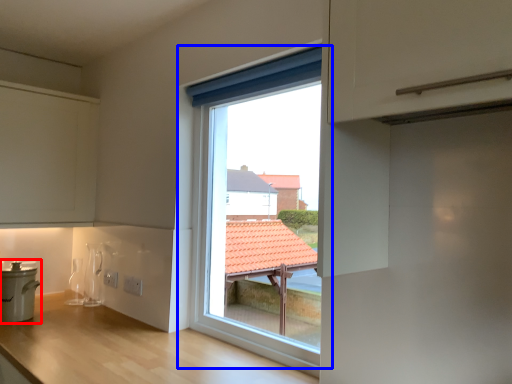
Question: Which point is further to the camera, cooker (highlighted by a red box) or window (highlighted by a blue box)?

Choices:
 (A) cooker
 (B) window

Answer: (A)